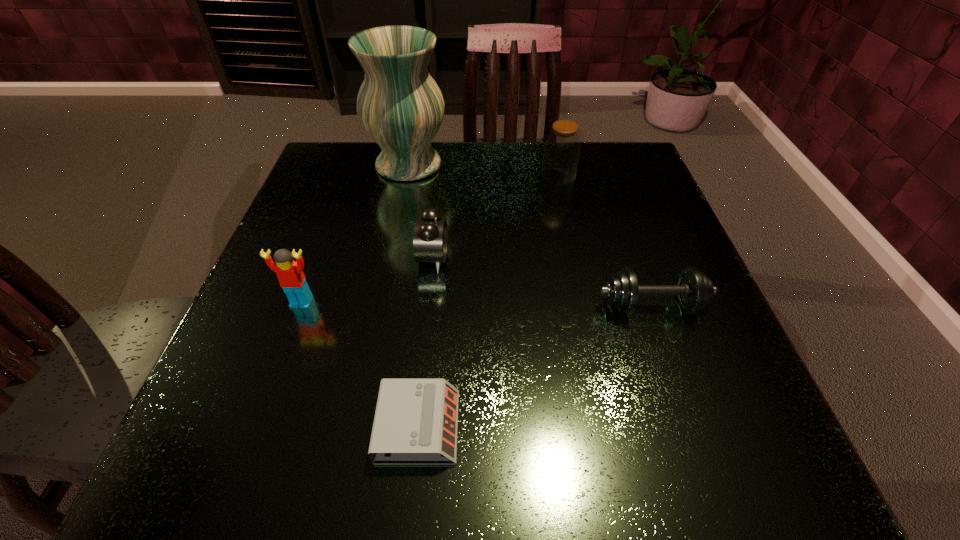
Where is `vacant region between the taller alarm clock and the tallest object`? vacant region between the taller alarm clock and the tallest object is located at coordinates (420, 212).

You are a GUI agent. You are given a task and a screenshot of the screen. Output one action in this format:
    pyautogui.click(x=<x>, y=<y>)
    Task: Click on the empty location between the leftmost object and the tallest object
    This screenshot has width=960, height=540.
    Given the screenshot: What is the action you would take?
    pyautogui.click(x=355, y=233)

The width and height of the screenshot is (960, 540). Identify the location of free spot between the tallest object and the jar. (484, 170).

Where is `free area in between the jar and the dumbbell`? This screenshot has height=540, width=960. free area in between the jar and the dumbbell is located at coordinates click(x=605, y=241).

Where is `free space between the second shortest object and the tallest object`? free space between the second shortest object and the tallest object is located at coordinates (530, 235).

Locate an element on the screen. The width and height of the screenshot is (960, 540). unoccupied area between the leftmost object and the fourth nearest object is located at coordinates (368, 280).

You are a GUI agent. You are given a task and a screenshot of the screen. Output one action in this format:
    pyautogui.click(x=<x>, y=<y>)
    Task: Click on the free space between the dumbbell and the vase
    
    Given the screenshot: What is the action you would take?
    pyautogui.click(x=530, y=235)

Find the location of a particular element. This screenshot has height=540, width=960. free space between the taller alarm clock and the jar is located at coordinates (495, 217).

Locate which object is the second closest to the nearer alarm clock. Please provide its 2D coordinates. Your answer should be formatted as a tuple, i.e. [(x, y)], where the tuple contains the x and y coordinates of a point satisfying the conditions above.

[(430, 236)]

What are the coordinates of `object that can be found as the closest to the vase` in the screenshot? It's located at (430, 236).